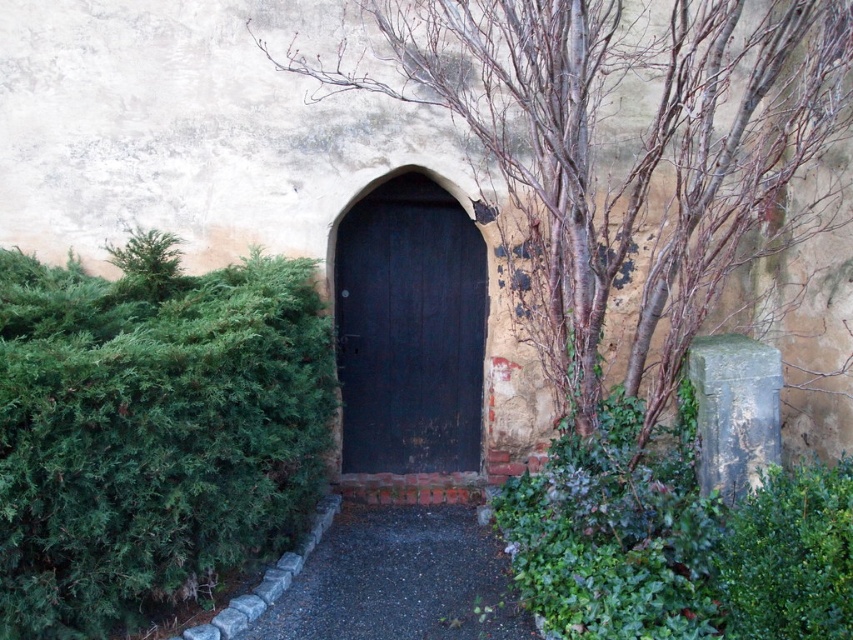
Identify the location of green leafy hedge at left. (152, 432).

Is green leafy hedge at left behind dark wood door at center?

No.

Find the location of a particular element. green leafy hedge at left is located at coordinates (152, 432).

This screenshot has width=853, height=640. I want to click on green leafy hedge at left, so click(152, 432).

Can you confirm if bark textured tree at center is smaller than green leafy hedge at left?

Actually, bark textured tree at center might be larger than green leafy hedge at left.

The width and height of the screenshot is (853, 640). I want to click on bark textured tree at center, so click(619, 152).

Looking at this image, is bark textured tree at center positioned at the back of dark gravel path at center?

No, bark textured tree at center is in front of dark gravel path at center.

Can you confirm if bark textured tree at center is positioned to the right of dark gravel path at center?

Yes, bark textured tree at center is to the right of dark gravel path at center.

Who is more forward, [289,52] or [485,532]?

Point [485,532] is in front.

The width and height of the screenshot is (853, 640). In order to click on bark textured tree at center in this screenshot , I will do `click(619, 152)`.